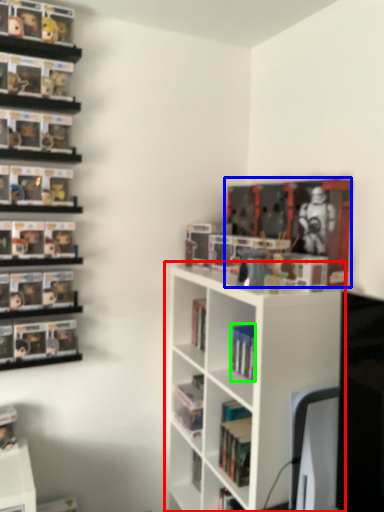
Question: Which object is the farthest from shelf (highlighted by a red box)? Choose among these: book (highlighted by a blue box) or book (highlighted by a green box).

Choices:
 (A) book
 (B) book

Answer: (A)